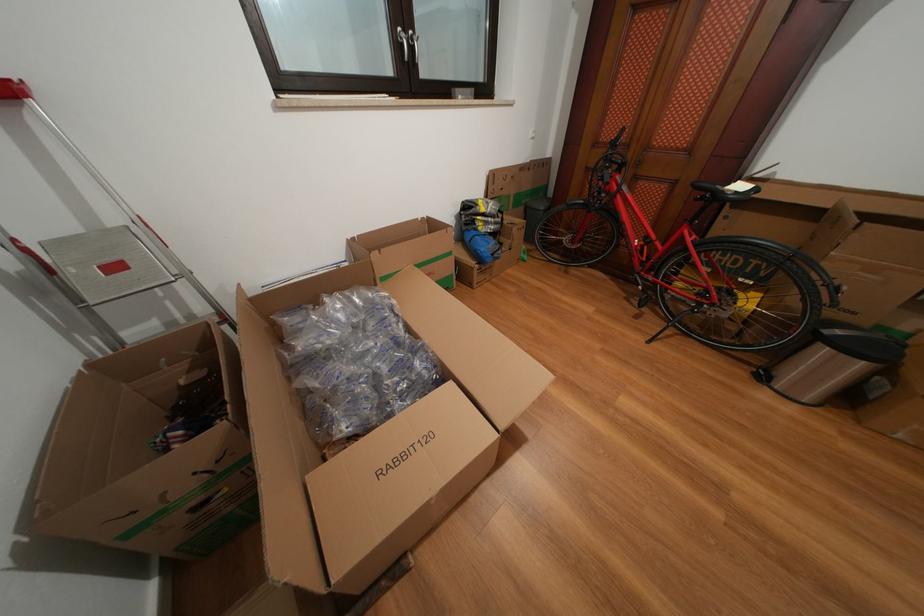
The width and height of the screenshot is (924, 616). I want to click on window handle, so click(x=408, y=43).